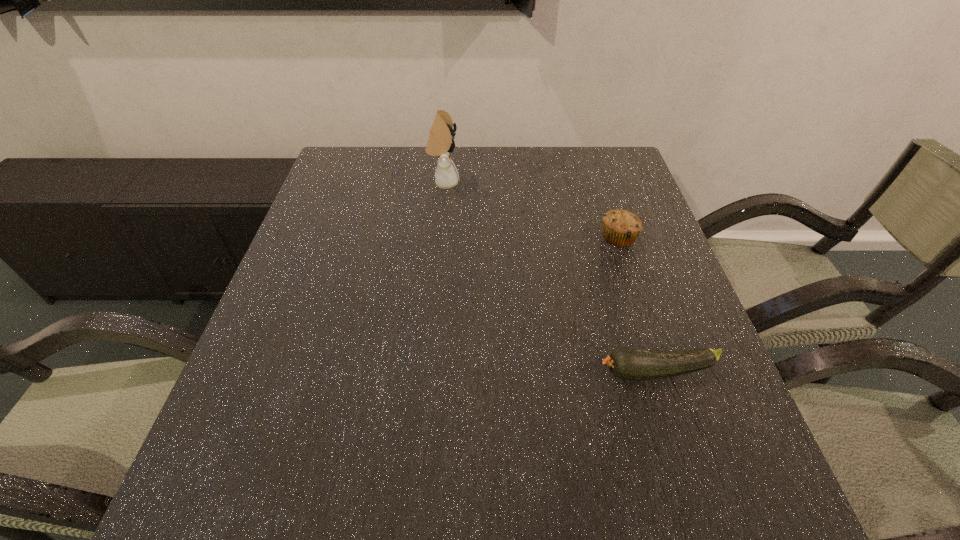
Choose which object is the nearest neighbor to the tallest object. Please provide its 2D coordinates. Your answer should be formatted as a tuple, i.e. [(x, y)], where the tuple contains the x and y coordinates of a point satisfying the conditions above.

[(621, 228)]

Where is `blank space that satisfies the following two spatial constraints: 1. at the front face of the muffin; 2. on the left side of the leftmost object`? The image size is (960, 540). blank space that satisfies the following two spatial constraints: 1. at the front face of the muffin; 2. on the left side of the leftmost object is located at coordinates (439, 237).

I want to click on free space that satisfies the following two spatial constraints: 1. on the front side of the second farthest object; 2. at the blossom end of the shortest object, so click(x=663, y=372).

I want to click on free point that satisfies the following two spatial constraints: 1. at the front face of the leftmost object; 2. on the right side of the second shortest object, so click(439, 237).

The width and height of the screenshot is (960, 540). Identify the location of free space that satisfies the following two spatial constraints: 1. on the front side of the muffin; 2. at the blossom end of the zucchini. (663, 372).

Where is `free space that satisfies the following two spatial constraints: 1. on the front side of the second tallest object; 2. at the blossom end of the shortest object`? free space that satisfies the following two spatial constraints: 1. on the front side of the second tallest object; 2. at the blossom end of the shortest object is located at coordinates (663, 372).